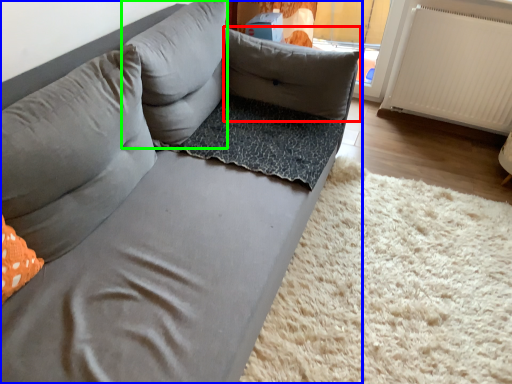
Question: Based on their relative distances, which object is farther from pillow (highlighted by a red box)? Choose from studio couch (highlighted by a blue box) and pillow (highlighted by a green box).

Choices:
 (A) studio couch
 (B) pillow

Answer: (A)